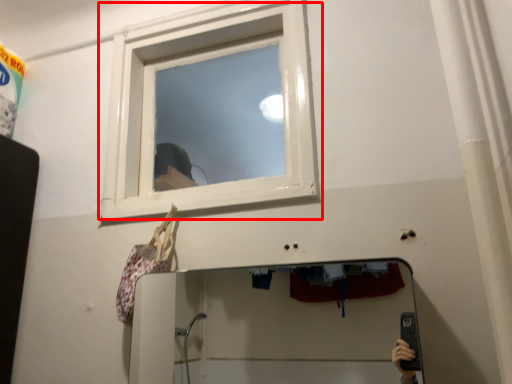
Question: From the image's perspective, what is the correct spatial relationship of window (annotated by the red box) in relation to mirror?

Choices:
 (A) below
 (B) above

Answer: (B)